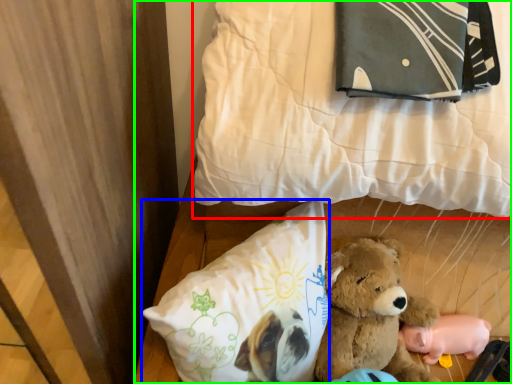
Question: Which object is positioned farthest from pillow (highlighted by a red box)? Select from pillow (highlighted by a blue box) and bed (highlighted by a green box).

Choices:
 (A) pillow
 (B) bed

Answer: (A)